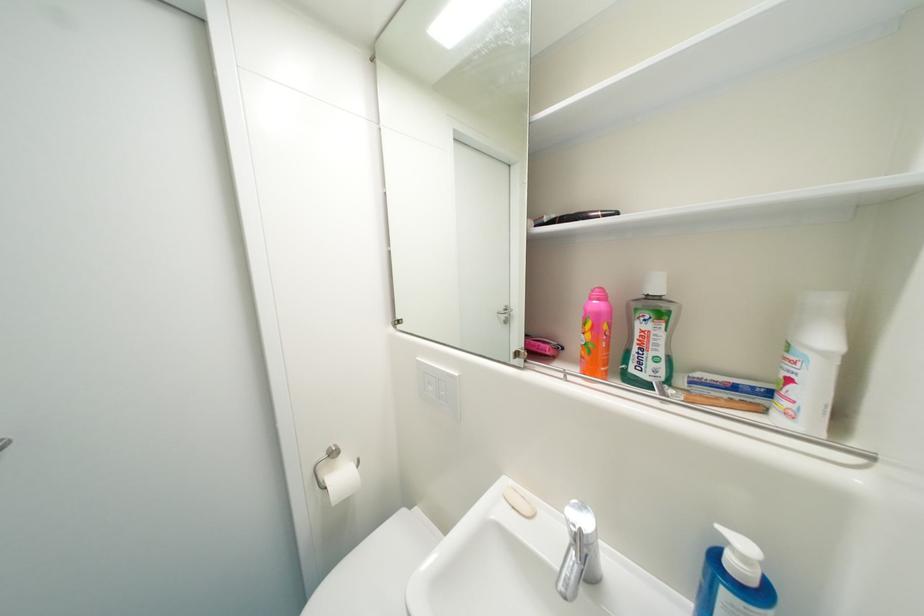
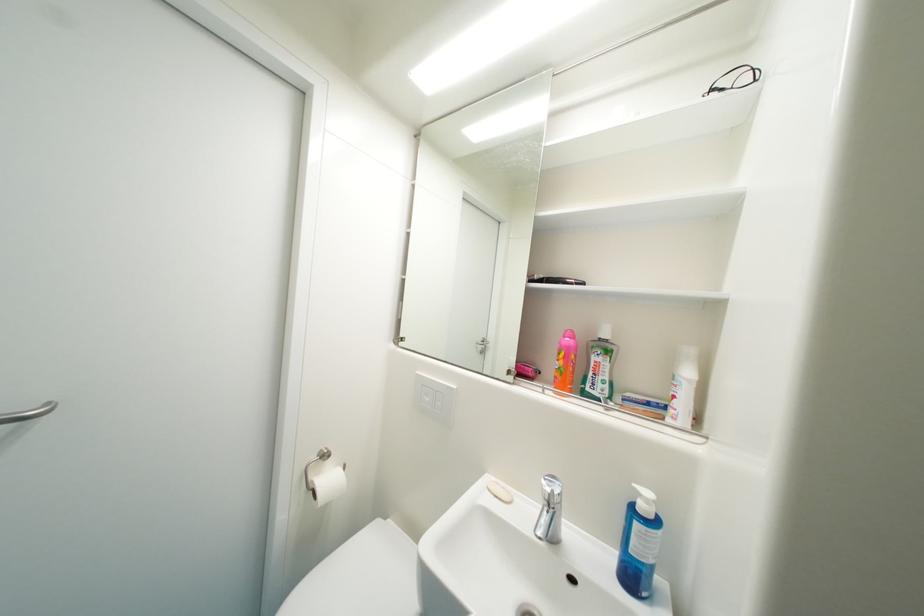
Where in the second image is the point corresponding to (x=406, y=329) from the first image?

(407, 345)